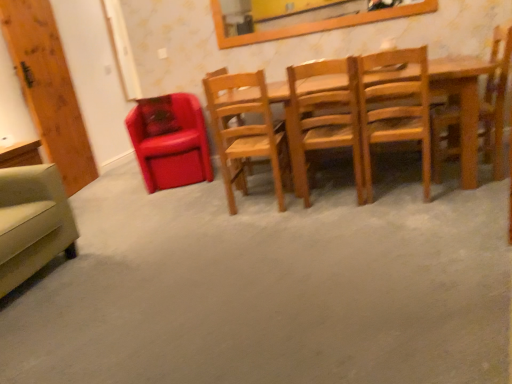
In order to click on vacant space in front of wooden chair at center, arranged as the third chair when viewed from the left in this screenshot , I will do `click(265, 221)`.